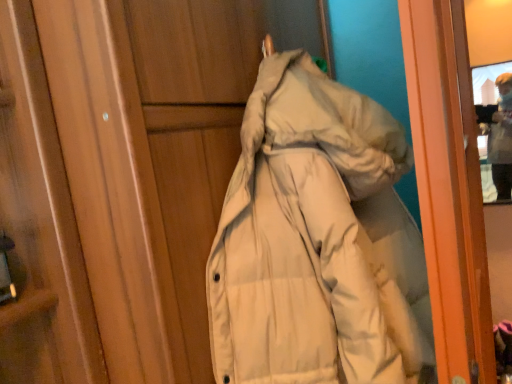
Question: Choose the correct answer: Is beige down jacket at upper center inside beige matte coat at center or outside it?

Choices:
 (A) outside
 (B) inside

Answer: (A)

Question: Considering their positions, is beige down jacket at upper center located in front of or behind beige matte coat at center?

Choices:
 (A) front
 (B) behind

Answer: (B)

Question: From a real-world perspective, relative to beige matte coat at center, is beige down jacket at upper center vertically above or below?

Choices:
 (A) above
 (B) below

Answer: (A)

Question: From the image's perspective, is beige matte coat at center above or below beige down jacket at upper center?

Choices:
 (A) above
 (B) below

Answer: (B)

Question: Considering the positions of beige matte coat at center and beige down jacket at upper center in the image, is beige matte coat at center wider or thinner than beige down jacket at upper center?

Choices:
 (A) wide
 (B) thin

Answer: (A)

Question: Considering the positions of point (404, 316) and point (495, 170), is point (404, 316) closer or farther from the camera than point (495, 170)?

Choices:
 (A) closer
 (B) farther

Answer: (A)

Question: Which is correct: beige matte coat at center is inside beige down jacket at upper center, or outside of it?

Choices:
 (A) inside
 (B) outside

Answer: (B)